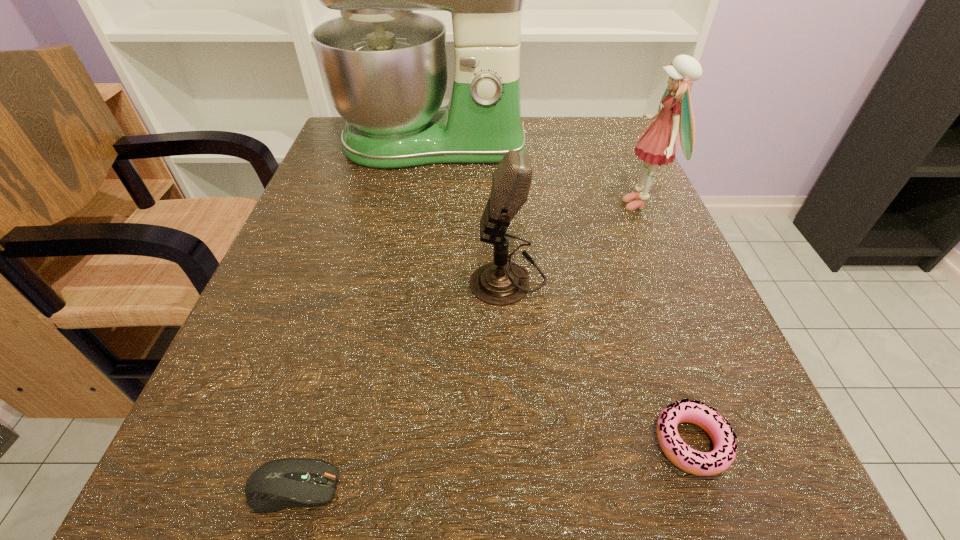
Find the location of `vacant space that's between the second farthest object and the third farthest object`. vacant space that's between the second farthest object and the third farthest object is located at coordinates (574, 241).

Where is `empty space that is in between the mixer and the third tallest object`? empty space that is in between the mixer and the third tallest object is located at coordinates (470, 211).

At what (x,y) coordinates should I click in order to perform the action: click on free space that is in between the third tallest object and the doughnut. Please return your answer as a coordinate pair (x, y). Looking at the image, I should click on (600, 360).

Select which object appears as the third closest to the doll. Please provide its 2D coordinates. Your answer should be formatted as a tuple, i.e. [(x, y)], where the tuple contains the x and y coordinates of a point satisfying the conditions above.

[(689, 460)]

Identify which object is the third nearest to the second tallest object. Please provide its 2D coordinates. Your answer should be formatted as a tuple, i.e. [(x, y)], where the tuple contains the x and y coordinates of a point satisfying the conditions above.

[(689, 460)]

Locate an element on the screen. This screenshot has height=540, width=960. free location that satisfies the following two spatial constraints: 1. on the controls of the tallest object; 2. on the button of the computer equipment is located at coordinates (380, 488).

Locate an element on the screen. The height and width of the screenshot is (540, 960). blank area in the image that satisfies the following two spatial constraints: 1. on the front-facing side of the second tallest object; 2. on the front side of the doughnut is located at coordinates (744, 443).

Identify the location of free point that satisfies the following two spatial constraints: 1. on the front-facing side of the third tallest object; 2. on the left side of the doughnut. The width and height of the screenshot is (960, 540). (518, 443).